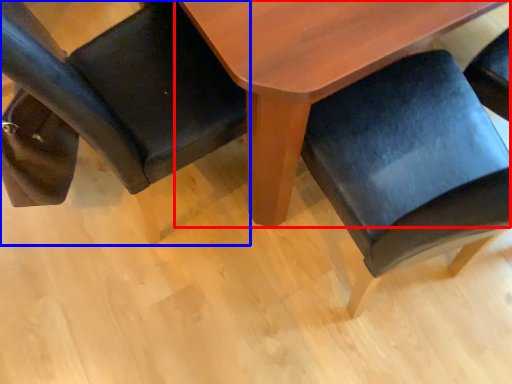
Question: Which of the following is the closest to the observer, table (highlighted by a red box) or chair (highlighted by a blue box)?

Choices:
 (A) table
 (B) chair

Answer: (B)